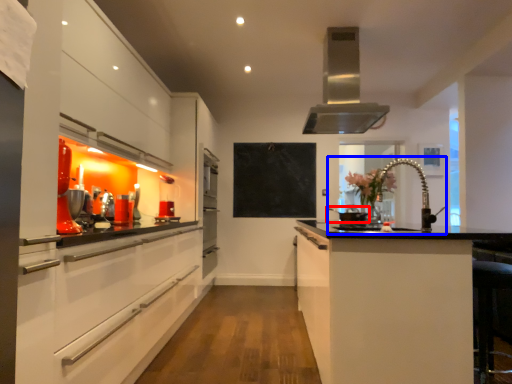
Question: Which point is closer to the camera, appliance (highlighted by a red box) or sink (highlighted by a blue box)?

Choices:
 (A) appliance
 (B) sink

Answer: (B)